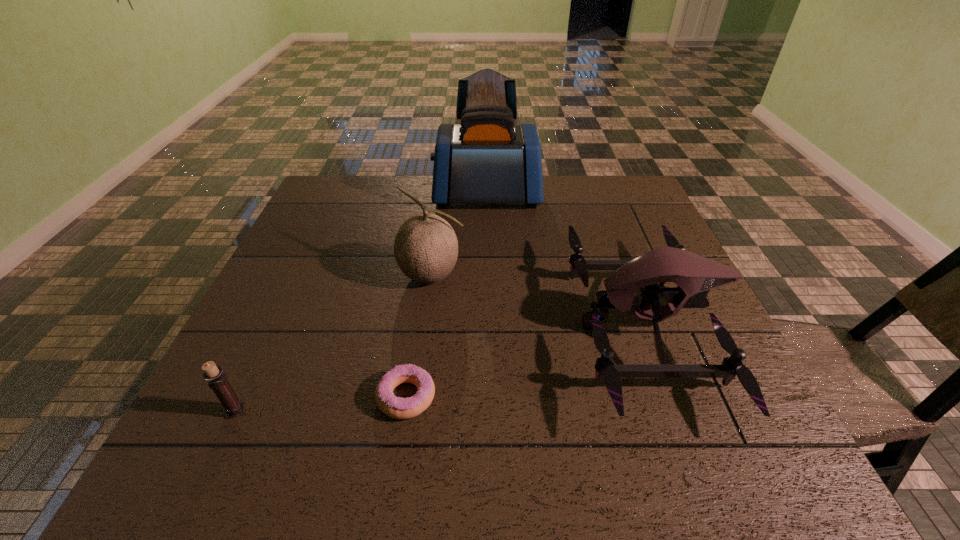
Image resolution: width=960 pixels, height=540 pixels. Find the location of `free spot between the cantaloup and the rightmost object`. free spot between the cantaloup and the rightmost object is located at coordinates (539, 301).

At what (x,y) coordinates should I click in order to perform the action: click on empty space that is in between the doughnut and the candle holder. Please return your answer as a coordinate pair (x, y). The image size is (960, 540). Looking at the image, I should click on (321, 403).

The image size is (960, 540). In order to click on empty location between the farthest object and the shortest object in this screenshot , I will do `click(446, 296)`.

What are the coordinates of `vacant region between the candle holder and the farthest object` in the screenshot? It's located at (361, 303).

Identify the location of unoccupied area between the fourth tallest object and the cantaloup. (334, 343).

Where is `the fourth closest object relative to the drone`? The width and height of the screenshot is (960, 540). the fourth closest object relative to the drone is located at coordinates 217,381.

Where is `the second closest object to the rightmost object`? the second closest object to the rightmost object is located at coordinates (425, 247).

You are a GUI agent. You are given a task and a screenshot of the screen. Output one action in this format:
    pyautogui.click(x=<x>, y=<y>)
    Task: Click on the free location that satisfies the following two spatial constraints: 1. on the back side of the cantaloup; 2. on the right side of the doughnut
    This screenshot has width=960, height=540.
    Given the screenshot: What is the action you would take?
    pyautogui.click(x=424, y=275)

Locate an element on the screen. The width and height of the screenshot is (960, 540). vacant space that satisfies the following two spatial constraints: 1. on the back side of the leftmost object; 2. on the left side of the cantaloup is located at coordinates (300, 275).

Where is `vacant space that satisfies the following two spatial constraints: 1. on the front-facing side of the tallest object; 2. on the front side of the cantaloup`? vacant space that satisfies the following two spatial constraints: 1. on the front-facing side of the tallest object; 2. on the front side of the cantaloup is located at coordinates click(489, 275).